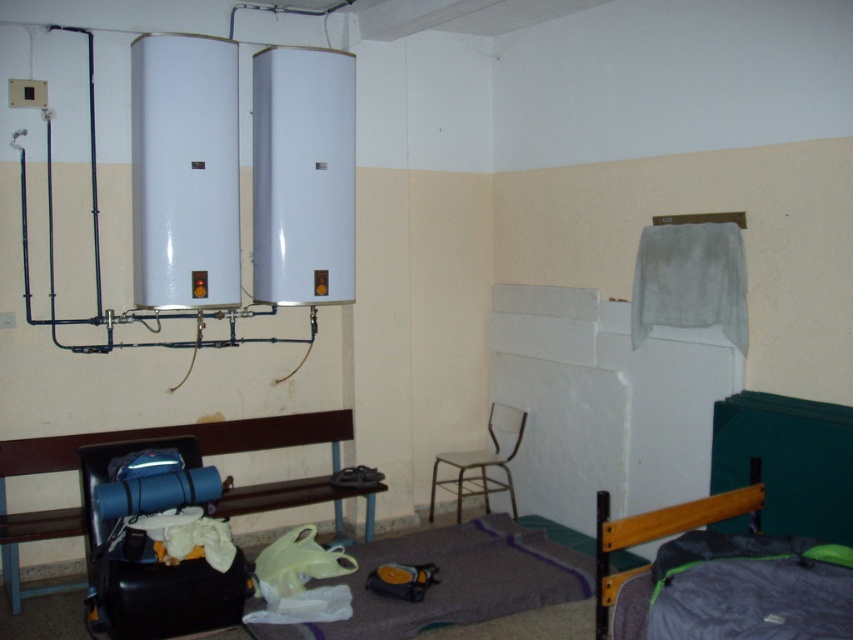
Question: Can you confirm if dark gray fabric bed at lower right is positioned to the left of metallic white chair at center?

Choices:
 (A) no
 (B) yes

Answer: (A)

Question: Estimate the real-world distances between objects in this image. Which object is farther from the dark gray fabric bed at lower right?

Choices:
 (A) black leather bench at lower left
 (B) metallic white chair at center

Answer: (A)

Question: Is black leather bench at lower left thinner than metallic white chair at center?

Choices:
 (A) yes
 (B) no

Answer: (B)

Question: Which point is farther from the camera taking this photo?

Choices:
 (A) (758, 588)
 (B) (35, 593)
 (C) (450, 456)

Answer: (C)

Question: Can you confirm if dark gray fabric bed at lower right is positioned to the left of metallic white chair at center?

Choices:
 (A) no
 (B) yes

Answer: (A)

Question: Among these objects, which one is nearest to the camera?

Choices:
 (A) dark gray fabric bed at lower right
 (B) black leather bench at lower left
 (C) metallic white chair at center

Answer: (A)